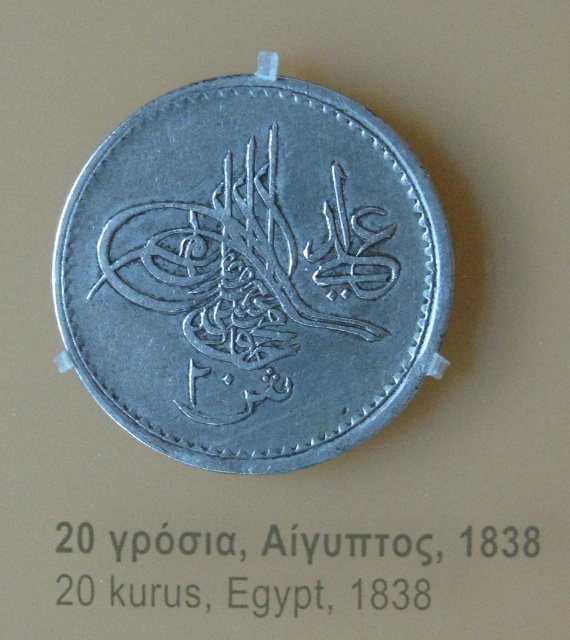
You are an archaeologist examining the historical coin. You notice the silver metallic coin at center and the black metallic text at center. Which object is bigger in size?

The silver metallic coin at center is larger in size compared to the black metallic text at center.

From the picture: You are a coin collector examining the historical Egyptian coin from 1838. You notice the silver metallic coin at center and the black metallic text at center. Which object is thicker?

The silver metallic coin at center is thinner than the black metallic text at center, so the black metallic text at center is thicker.